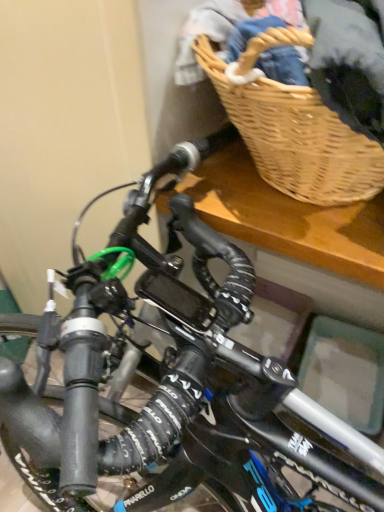
Question: Should I look upward or downward to see woven wood picnic basket at upper right?

Choices:
 (A) down
 (B) up

Answer: (B)